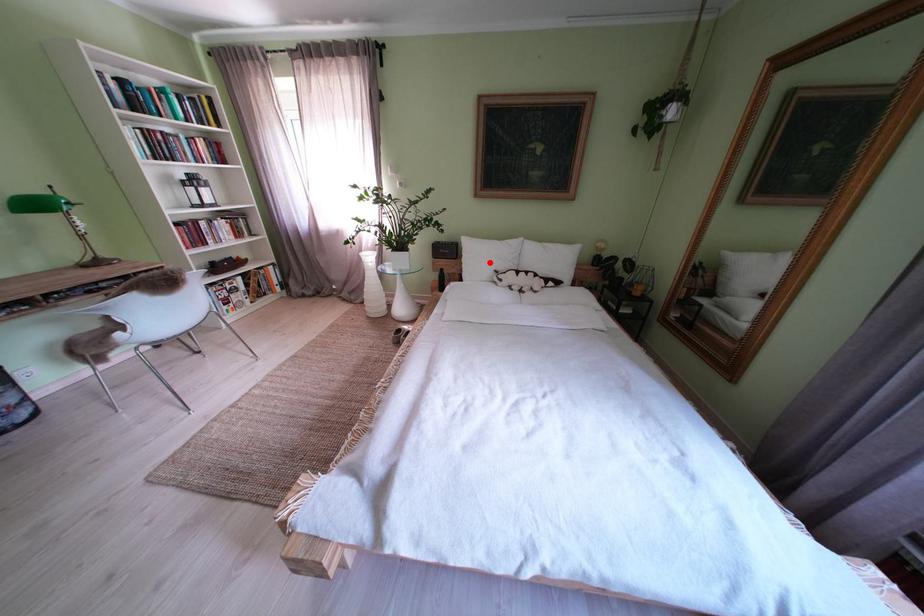
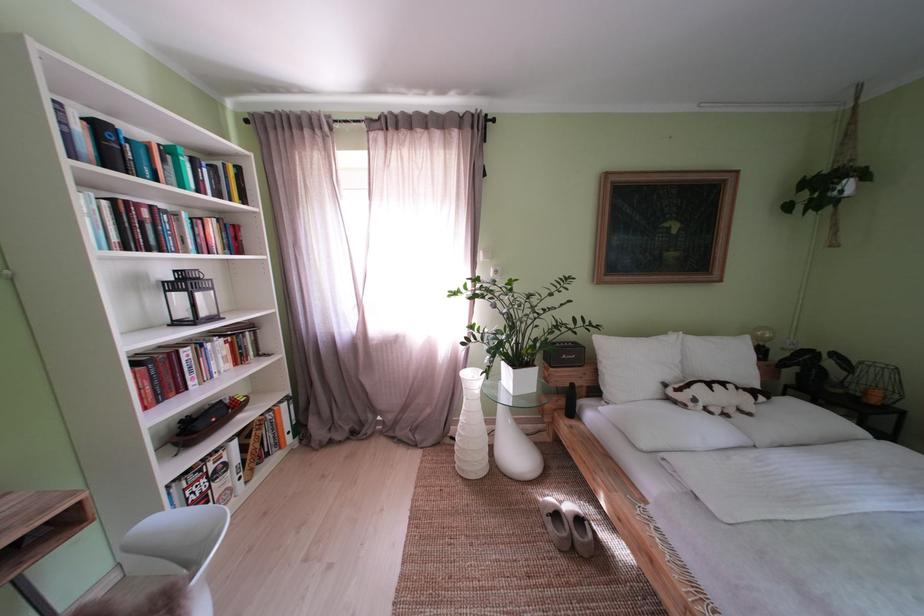
Question: I am providing you with two images of the same scene from different viewpoints. In image1, a red point is highlighted. Considering the same 3D point in image2, which of the following is correct?

Choices:
 (A) It is closer
 (B) It is farther

Answer: (B)